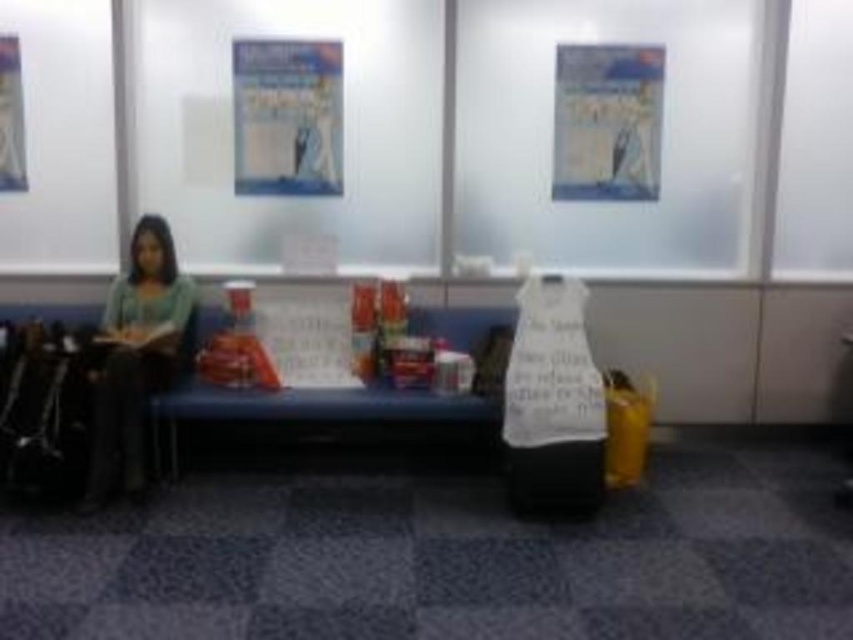
Question: Based on their relative distances, which object is farther from the metallic silver poster at upper left?

Choices:
 (A) matte green sweater at left
 (B) blue glossy poster at upper center

Answer: (B)

Question: Among these objects, which one is farthest from the camera?

Choices:
 (A) blue glossy poster at upper center
 (B) metallic silver poster at upper left
 (C) matte paper poster at upper center
 (D) matte green sweater at left

Answer: (C)

Question: Which object appears farthest from the camera in this image?

Choices:
 (A) matte green sweater at left
 (B) blue glossy poster at upper center
 (C) metallic silver poster at upper left
 (D) matte paper poster at upper center

Answer: (D)

Question: Does matte paper poster at upper center have a greater width compared to metallic silver poster at upper left?

Choices:
 (A) yes
 (B) no

Answer: (A)

Question: Is matte green sweater at left in front of matte paper poster at upper center?

Choices:
 (A) yes
 (B) no

Answer: (A)

Question: Does matte green sweater at left appear on the right side of blue glossy poster at upper center?

Choices:
 (A) no
 (B) yes

Answer: (A)